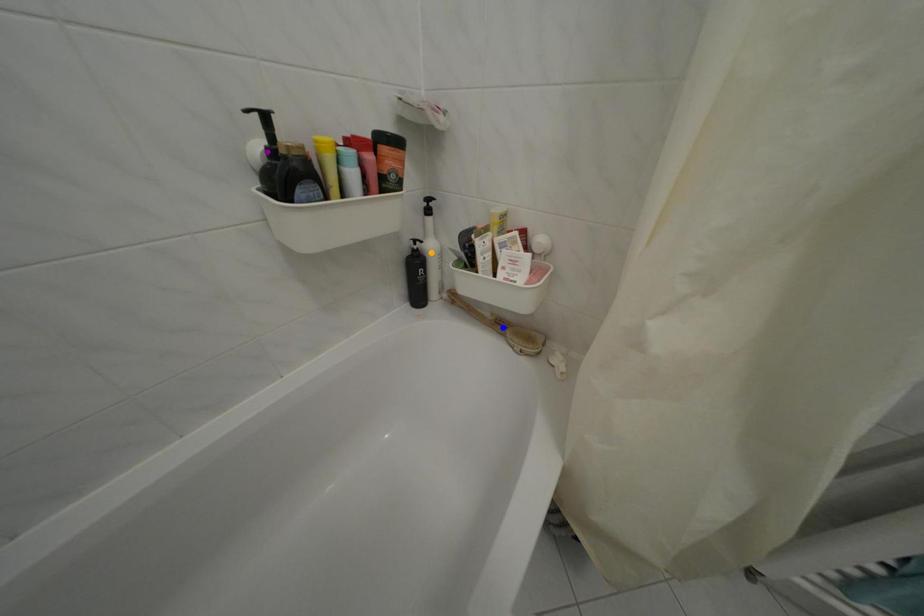
Order these from farthest to nearest:
blue point
orange point
purple point

orange point < blue point < purple point